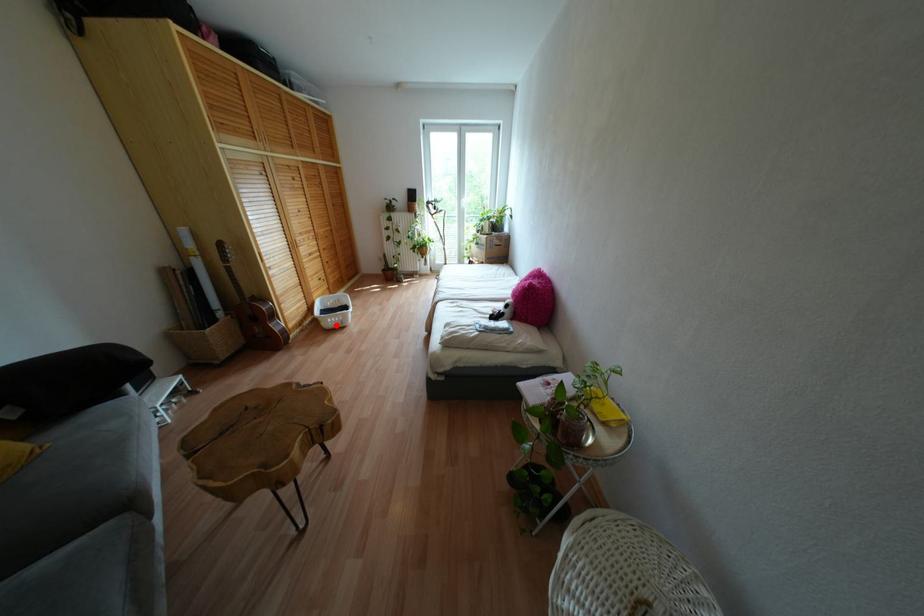
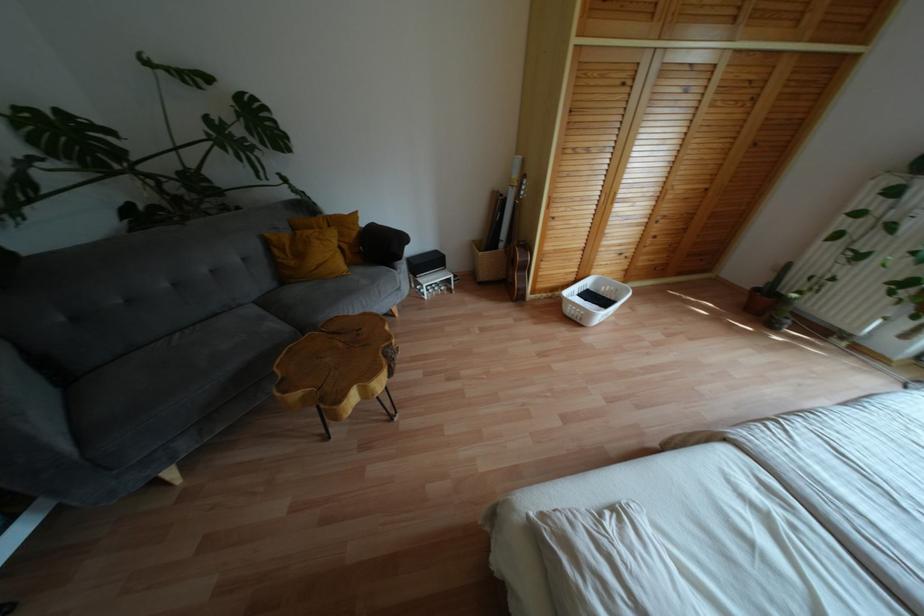
The point at the highlighted location is marked in the first image. Where is the corresponding point in the second image?

(573, 318)